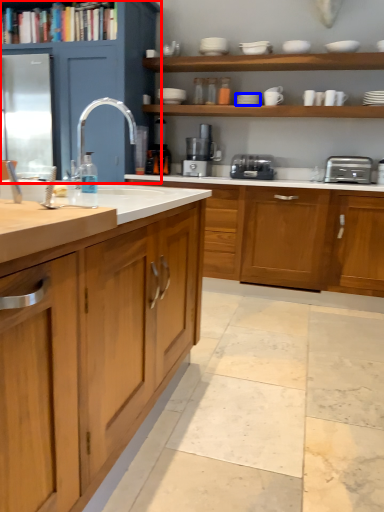
Question: Which of the following is the farthest to the observer, cabinetry (highlighted by a red box) or tableware (highlighted by a blue box)?

Choices:
 (A) cabinetry
 (B) tableware

Answer: (B)